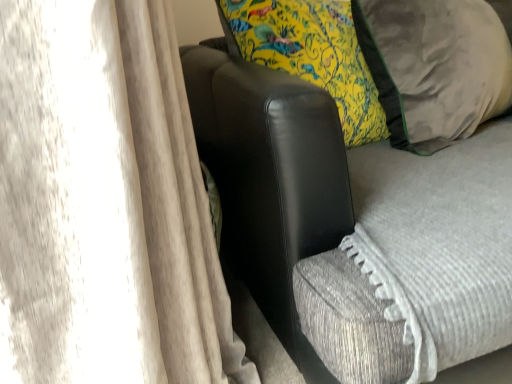
Locate an element on the screen. suede-like beige pillow at right is located at coordinates pos(437,66).

What do you see at coordinates (437, 66) in the screenshot? This screenshot has width=512, height=384. I see `suede-like beige pillow at right` at bounding box center [437, 66].

Locate an element on the screen. This screenshot has height=384, width=512. black leather armchair at center is located at coordinates (270, 177).

Describe the element at coordinates (270, 177) in the screenshot. I see `black leather armchair at center` at that location.

Locate an element on the screen. The height and width of the screenshot is (384, 512). suede-like beige pillow at right is located at coordinates click(x=437, y=66).

Visually, is suede-like beige pillow at right positioned to the left or to the right of black leather armchair at center?

suede-like beige pillow at right is positioned on black leather armchair at center's right side.

Considering their positions, is suede-like beige pillow at right located in front of or behind black leather armchair at center?

In the image, suede-like beige pillow at right appears behind black leather armchair at center.

Which is less distant, (362, 23) or (333, 173)?

Positioned in front is point (333, 173).

From the image's perspective, which one is positioned higher, suede-like beige pillow at right or black leather armchair at center?

suede-like beige pillow at right.

From a real-world perspective, is suede-like beige pillow at right above or below black leather armchair at center?

Clearly, from a real-world perspective, suede-like beige pillow at right is above black leather armchair at center.

Considering the sizes of objects suede-like beige pillow at right and black leather armchair at center in the image provided, who is wider, suede-like beige pillow at right or black leather armchair at center?

With larger width is black leather armchair at center.

Is suede-like beige pillow at right taller than black leather armchair at center?

In fact, suede-like beige pillow at right may be shorter than black leather armchair at center.

Considering the sizes of suede-like beige pillow at right and black leather armchair at center in the image, is suede-like beige pillow at right bigger or smaller than black leather armchair at center?

In the image, suede-like beige pillow at right appears to be smaller than black leather armchair at center.

Is suede-like beige pillow at right inside or outside of black leather armchair at center?

suede-like beige pillow at right exists entirely within black leather armchair at center.

Is suede-like beige pillow at right next to black leather armchair at center and touching it?

No, suede-like beige pillow at right is not beside black leather armchair at center.

Is suede-like beige pillow at right facing towards black leather armchair at center?

Yes, suede-like beige pillow at right is oriented towards black leather armchair at center.

What's the angular difference between suede-like beige pillow at right and black leather armchair at center's facing directions?

28.2 degrees separate the facing orientations of suede-like beige pillow at right and black leather armchair at center.

Locate an element on the screen. The image size is (512, 384). pillow on the right of black leather armchair at center is located at coordinates (437, 66).

Looking at this image, between black leather armchair at center and suede-like beige pillow at right, which one appears on the left side from the viewer's perspective?

black leather armchair at center is more to the left.

Relative to suede-like beige pillow at right, is black leather armchair at center in front or behind?

Visually, black leather armchair at center is located in front of suede-like beige pillow at right.

Which is farther from the camera, (x=232, y=247) or (x=416, y=100)?

The point (x=232, y=247) is behind.

From the image's perspective, which object appears higher, black leather armchair at center or suede-like beige pillow at right?

suede-like beige pillow at right appears higher in the image.

From a real-world perspective, is black leather armchair at center physically located above or below suede-like beige pillow at right?

From a real-world perspective, black leather armchair at center is physically below suede-like beige pillow at right.

Which object is thinner, black leather armchair at center or suede-like beige pillow at right?

suede-like beige pillow at right.

Can you confirm if black leather armchair at center is taller than suede-like beige pillow at right?

Correct, black leather armchair at center is much taller as suede-like beige pillow at right.

Can you confirm if black leather armchair at center is bigger than suede-like beige pillow at right?

Yes, black leather armchair at center is bigger than suede-like beige pillow at right.

Would you say suede-like beige pillow at right is part of black leather armchair at center's contents?

Yes, suede-like beige pillow at right is inside black leather armchair at center.

Is black leather armchair at center far away from suede-like beige pillow at right?

black leather armchair at center is actually quite close to suede-like beige pillow at right.

Is black leather armchair at center turned away from suede-like beige pillow at right?

That's right, black leather armchair at center is facing away from suede-like beige pillow at right.

Where is `furniture lying on the left of suede-like beige pillow at right`? The width and height of the screenshot is (512, 384). furniture lying on the left of suede-like beige pillow at right is located at coordinates (270, 177).

Find the location of a particular element. The width and height of the screenshot is (512, 384). pillow that appears above the black leather armchair at center (from the image's perspective) is located at coordinates (437, 66).

At what (x,y) coordinates should I click in order to perform the action: click on furniture below the suede-like beige pillow at right (from the image's perspective). Please return your answer as a coordinate pair (x, y). This screenshot has height=384, width=512. Looking at the image, I should click on (270, 177).